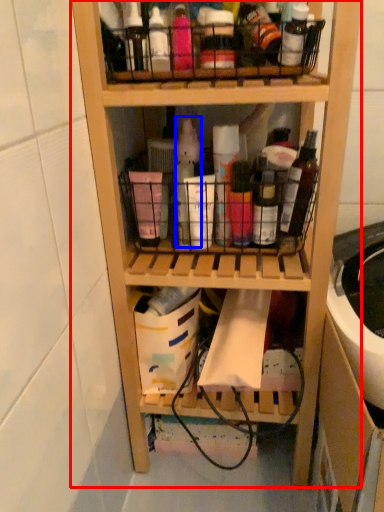
Question: Which object is closer to the camera taking this photo, shelf (highlighted by a red box) or bottle (highlighted by a blue box)?

Choices:
 (A) shelf
 (B) bottle

Answer: (A)